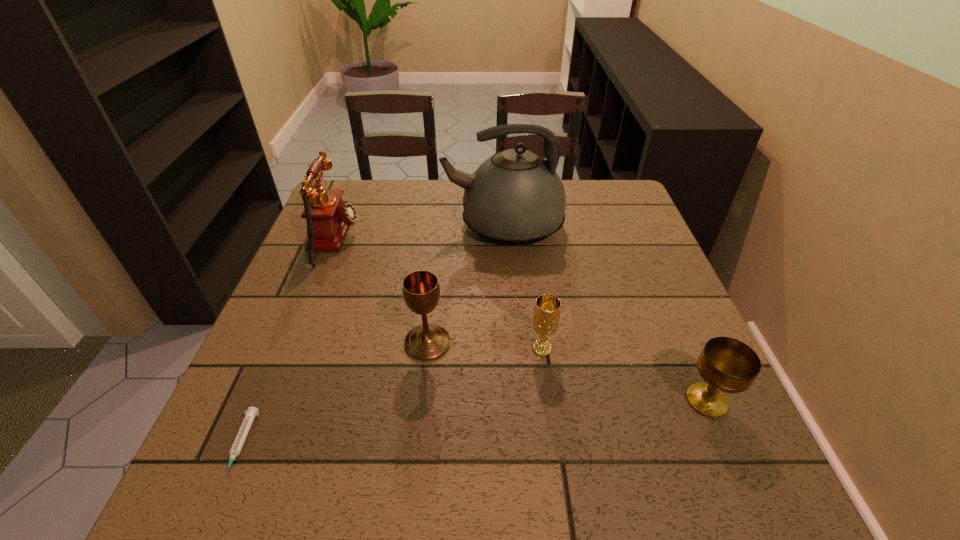
Identify the location of vacant space located at the spout of the kettle. (317, 226).

Image resolution: width=960 pixels, height=540 pixels. I want to click on free region located on the dial of the telephone, so click(478, 240).

Where is `vacant area located on the left of the fourth shortest object`? This screenshot has width=960, height=540. vacant area located on the left of the fourth shortest object is located at coordinates (318, 343).

Find the location of a particular element. The height and width of the screenshot is (540, 960). blank area located on the back of the second chalice from left to right is located at coordinates (538, 318).

At what (x,y) coordinates should I click in order to perform the action: click on free spot located on the back of the nearest chalice. Please return your answer as a coordinate pair (x, y). The width and height of the screenshot is (960, 540). Looking at the image, I should click on tap(648, 265).

In order to click on kettle that is at the far edge in this screenshot , I will do `click(515, 198)`.

Locate an element on the screen. The image size is (960, 540). telephone that is at the far edge is located at coordinates (328, 217).

Locate an element on the screen. The height and width of the screenshot is (540, 960). object that is positioned at the near edge is located at coordinates (236, 448).

Locate an element on the screen. This screenshot has width=960, height=540. telephone that is at the left edge is located at coordinates (328, 217).

Find the location of a particular element. The image size is (960, 540). syringe that is at the left edge is located at coordinates (236, 448).